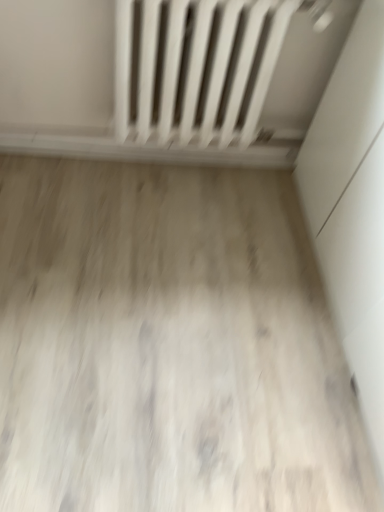
Question: From the image's perspective, relative to wooden floor at center, is white matte radiator at upper center above or below?

Choices:
 (A) below
 (B) above

Answer: (B)

Question: In terms of height, does white matte radiator at upper center look taller or shorter compared to wooden floor at center?

Choices:
 (A) short
 (B) tall

Answer: (B)

Question: Is white matte radiator at upper center to the left or to the right of wooden floor at center in the image?

Choices:
 (A) left
 (B) right

Answer: (B)

Question: From their relative heights in the image, would you say wooden floor at center is taller or shorter than white matte radiator at upper center?

Choices:
 (A) short
 (B) tall

Answer: (A)

Question: In the image, is wooden floor at center positioned in front of or behind white matte radiator at upper center?

Choices:
 (A) front
 (B) behind

Answer: (A)

Question: From the image's perspective, is wooden floor at center located above or below white matte radiator at upper center?

Choices:
 (A) below
 (B) above

Answer: (A)

Question: From a real-world perspective, is wooden floor at center positioned above or below white matte radiator at upper center?

Choices:
 (A) above
 (B) below

Answer: (B)